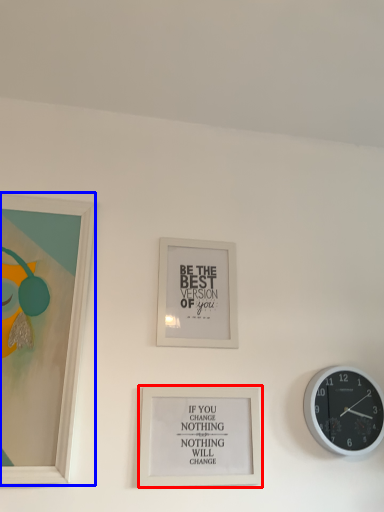
Question: Among these objects, which one is nearest to the camera, picture frame (highlighted by a red box) or picture frame (highlighted by a blue box)?

Choices:
 (A) picture frame
 (B) picture frame

Answer: (B)